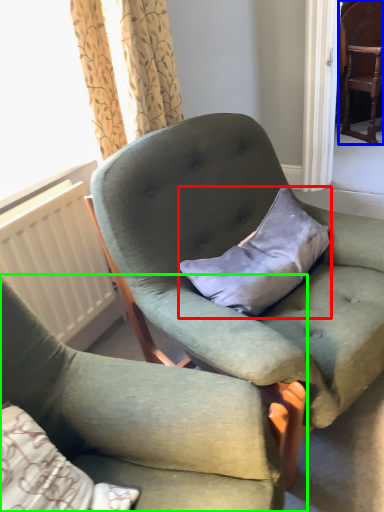
Question: Which object is the closest to the pillow (highlighted by a red box)? Choose among these: chair (highlighted by a blue box) or chair (highlighted by a green box).

Choices:
 (A) chair
 (B) chair

Answer: (B)